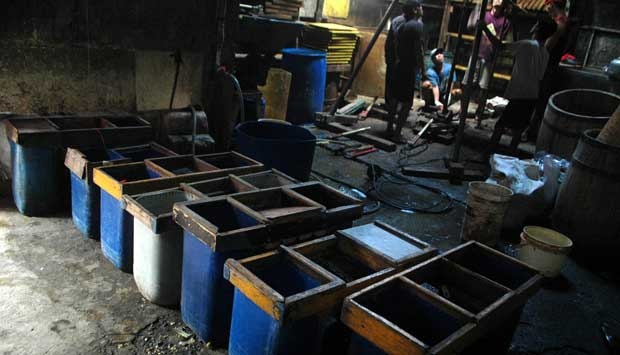
At what (x,y) coordinates should I click in order to perform the action: click on the chest. Please return your answer as a coordinate pair (x, y). Looking at the image, I should click on (415, 60).